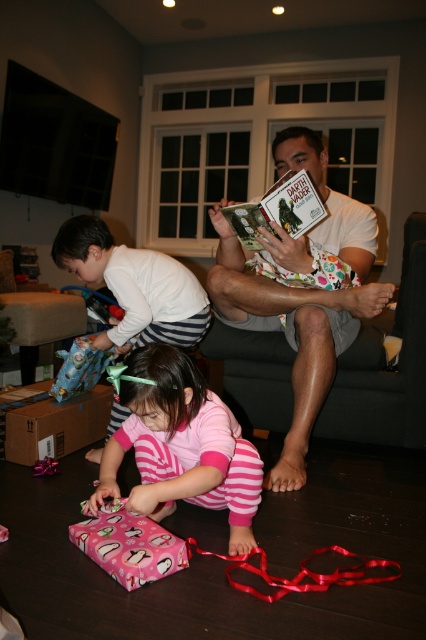
Question: Which object is positioned closest to the pink striped pajamas at lower center?

Choices:
 (A) pink glossy wrapping paper at lower left
 (B) white dotted shorts at center
 (C) white striped pants at left
 (D) hardcover book at center

Answer: (A)

Question: Is white dotted shorts at center bigger than pink striped pajamas at lower center?

Choices:
 (A) no
 (B) yes

Answer: (B)

Question: Which of these objects is positioned closest to the hardcover book at center?

Choices:
 (A) pink striped pajamas at lower center
 (B) white dotted shorts at center

Answer: (B)

Question: Considering the relative positions of white striped pants at left and hardcover book at center in the image provided, where is white striped pants at left located with respect to hardcover book at center?

Choices:
 (A) right
 (B) left

Answer: (B)

Question: Which point is closer to the camera taking this photo?

Choices:
 (A) (134, 252)
 (B) (129, 589)
 (C) (325, 305)

Answer: (B)

Question: Is pink striped pajamas at lower center positioned behind pink glossy wrapping paper at lower left?

Choices:
 (A) yes
 (B) no

Answer: (A)